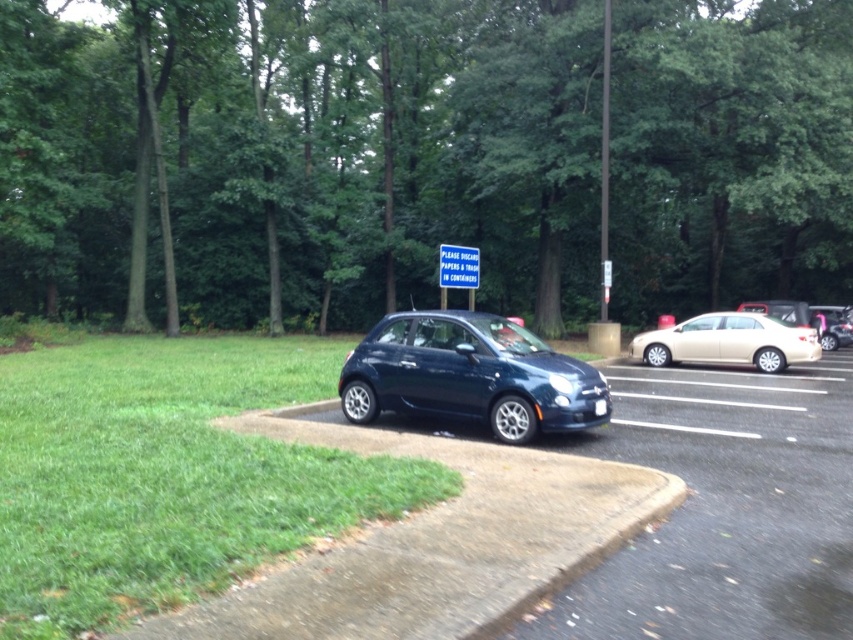
Based on the scene, what is the 2D coordinate of the green leafy tree at upper center?

The green leafy tree at upper center is located at the 2D coordinate point of (422, 156).

You are a driver who just arrived at the parking lot and need to exit your car. You want to walk towards the green leafy tree at upper center and the glossy dark blue hatchback at center. Which object will you encounter first?

You will encounter the green leafy tree at upper center first because it is closer to you than the glossy dark blue hatchback at center, which is further away.

You are standing at the parking area and want to take a photo of the green leafy tree at upper center and the satin gold sedan at right. Which object should you zoom in more on to ensure both are clearly visible in the frame?

You should zoom in more on the green leafy tree at upper center because it is larger in size than the satin gold sedan at right, so it will take up more space in the photo.